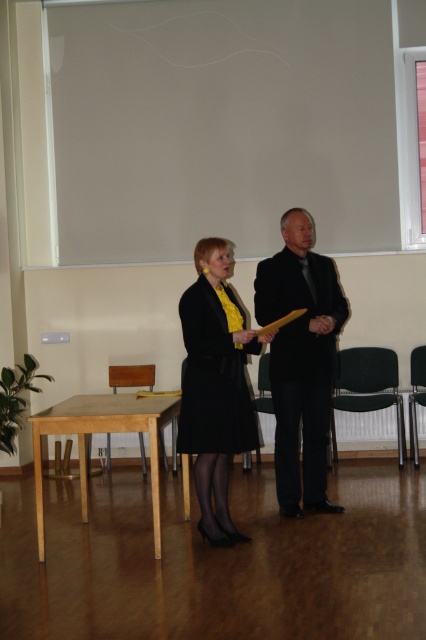
Question: Is light brown wooden chair at lower left smaller than black plastic chair at center?

Choices:
 (A) yes
 (B) no

Answer: (A)

Question: Among these objects, which one is farthest from the camera?

Choices:
 (A) black plastic chair at right
 (B) black plastic chair at center
 (C) black smooth suit at center

Answer: (B)

Question: Does black smooth suit at center appear under light brown wooden chair at lower left?

Choices:
 (A) yes
 (B) no

Answer: (B)

Question: Which point is farther from the camera taking this photo?

Choices:
 (A) [267, 381]
 (B) [416, 452]

Answer: (A)

Question: Which point appears closest to the camera in this image?

Choices:
 (A) (412, 380)
 (B) (391, 385)
 (C) (271, 400)

Answer: (C)

Question: Can you confirm if black plastic chair at right is positioned to the left of black plastic chair at center?

Choices:
 (A) no
 (B) yes

Answer: (A)